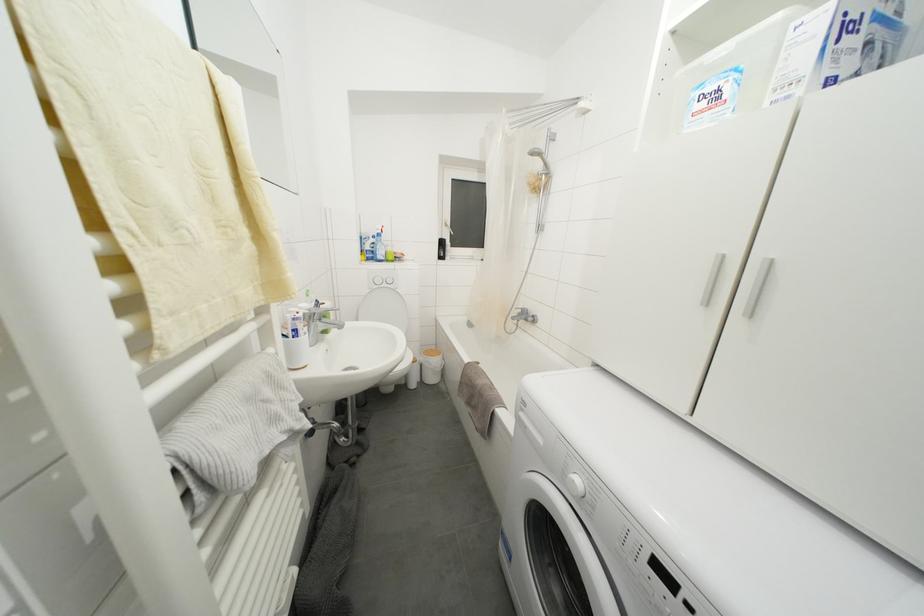
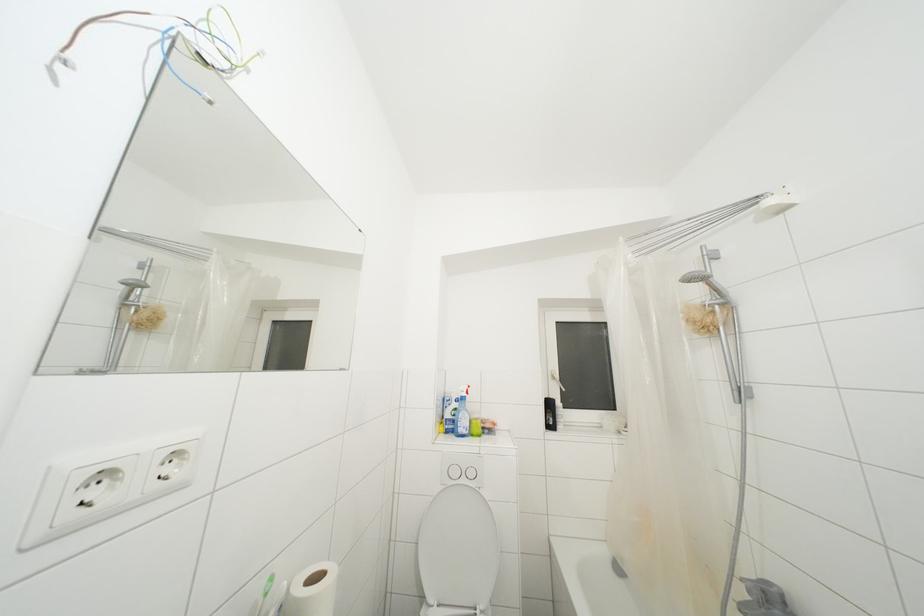
Based on the continuous images, in which direction is the camera rotating?

The rotation direction of the camera is left-up.